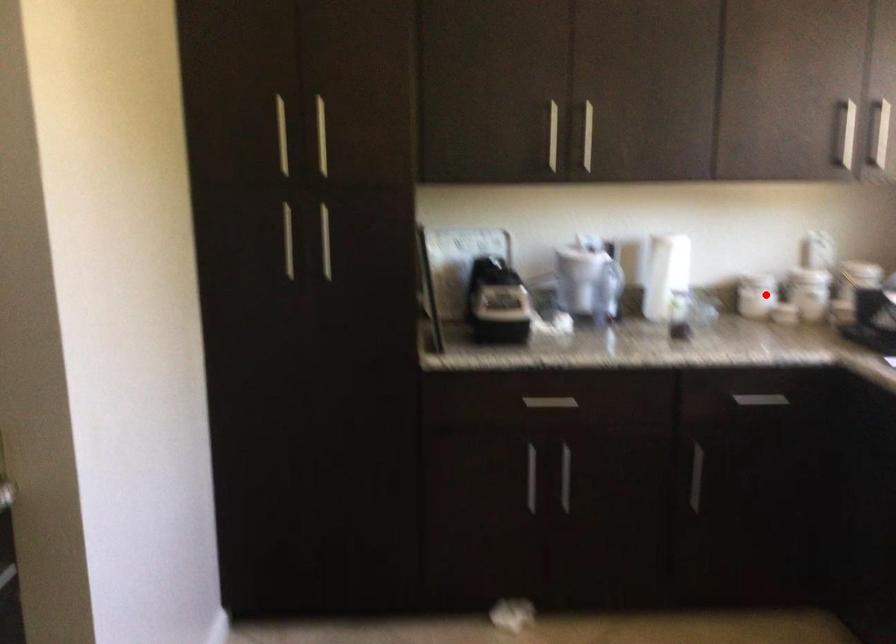
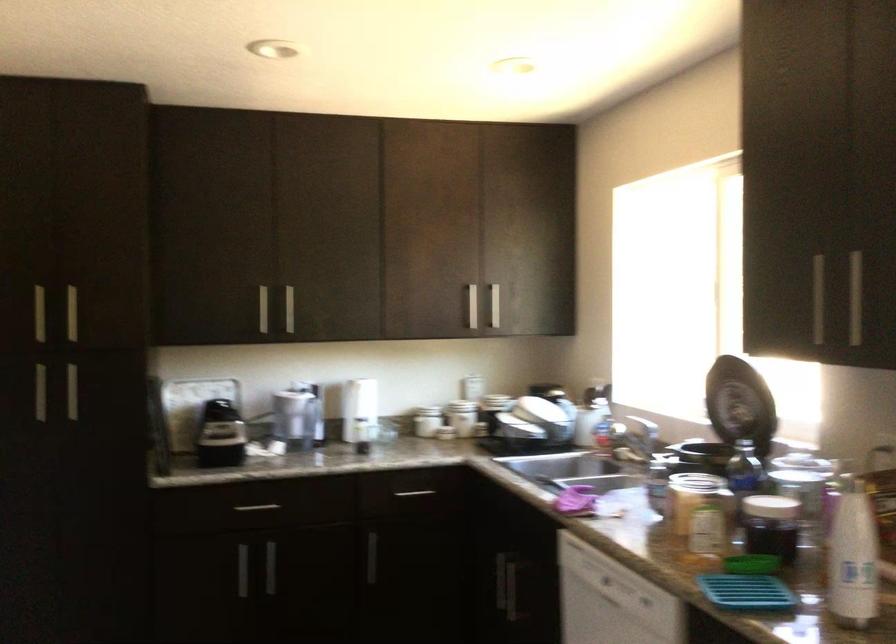
Locate, in the second image, the point that corresponds to the highlighted location in the first image.

(426, 421)